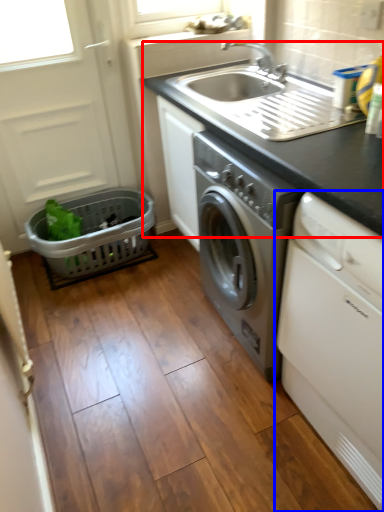
Question: Which object appears closest to the camera in this image, countertop (highlighted by a red box) or washing machine (highlighted by a blue box)?

Choices:
 (A) countertop
 (B) washing machine

Answer: (B)